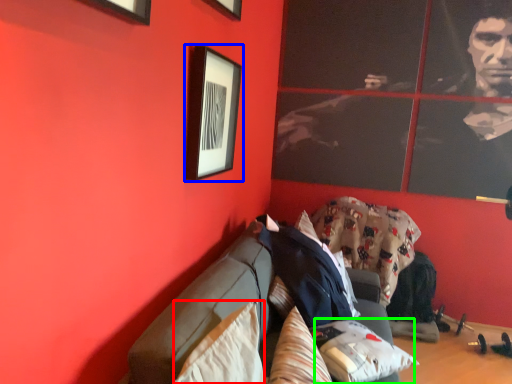
Question: Which object is positioned farthest from pillow (highlighted by a red box)? Select from picture frame (highlighted by a blue box) and pillow (highlighted by a green box).

Choices:
 (A) picture frame
 (B) pillow

Answer: (A)